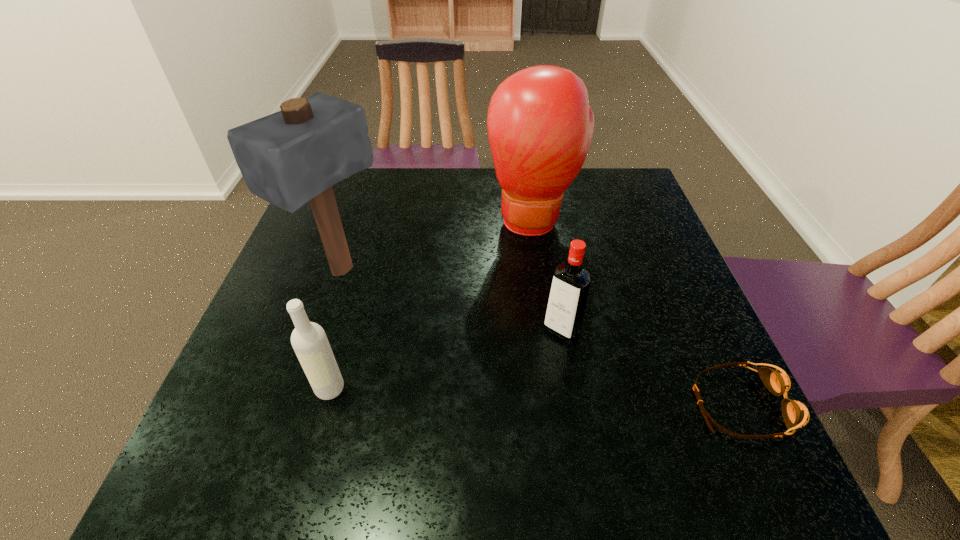
At what (x,y) coordinates should I click in order to perform the action: click on vacant space located 0.380m on the striking surface of the mallet. Please return your answer as a coordinate pair (x, y). Looking at the image, I should click on pyautogui.click(x=517, y=369).

This screenshot has width=960, height=540. Identify the location of free space located 0.160m on the striking surface of the boxing glove. (x=532, y=292).

Identify the location of vacant space situated 0.290m on the striking surface of the boxing glove. The height and width of the screenshot is (540, 960). (532, 337).

I want to click on blank space located on the striking surface of the boxing glove, so click(532, 333).

Where is `vacant space located on the front and back of the farther vodka`? This screenshot has height=540, width=960. vacant space located on the front and back of the farther vodka is located at coordinates (510, 390).

Identify the location of blank space located on the front and back of the farther vodka. Image resolution: width=960 pixels, height=540 pixels. (540, 356).

Locate an element on the screen. This screenshot has width=960, height=540. vacant space positioned on the front and back of the farther vodka is located at coordinates (491, 413).

Image resolution: width=960 pixels, height=540 pixels. Find the location of `object that is at the far edge`. object that is at the far edge is located at coordinates (540, 126).

What are the coordinates of `vodka that is at the near edge` in the screenshot? It's located at (309, 341).

Find the location of `goggles that is at the near edge`. goggles that is at the near edge is located at coordinates [795, 414].